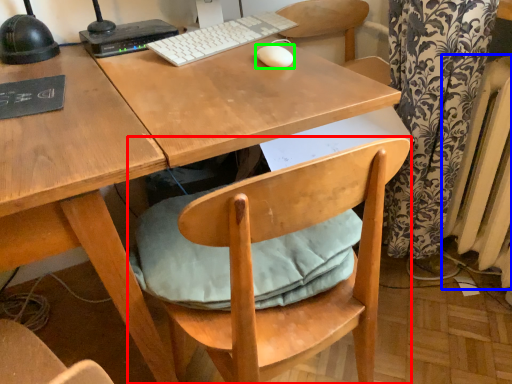
Question: Estimate the real-world distances between objects in this image. Which object is closer to chair (highlighted by a red box), radiator (highlighted by a blue box) or mouse (highlighted by a green box)?

Choices:
 (A) radiator
 (B) mouse

Answer: (B)